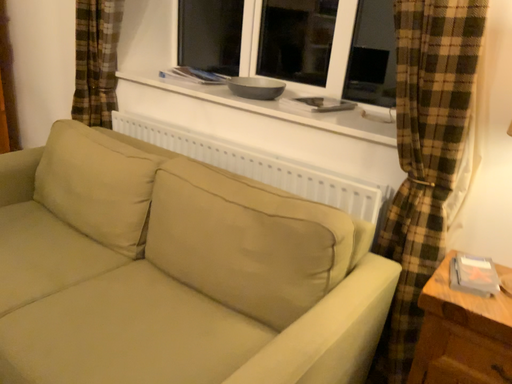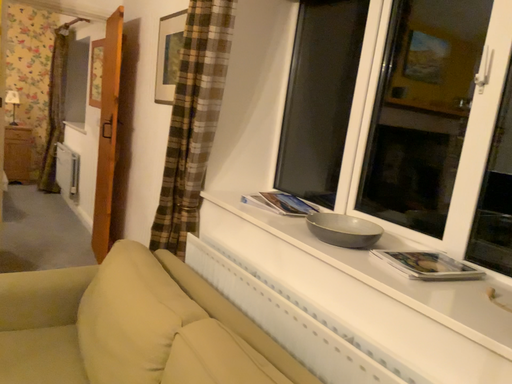
Question: Which way did the camera rotate in the video?

Choices:
 (A) rotated upward
 (B) rotated downward

Answer: (A)